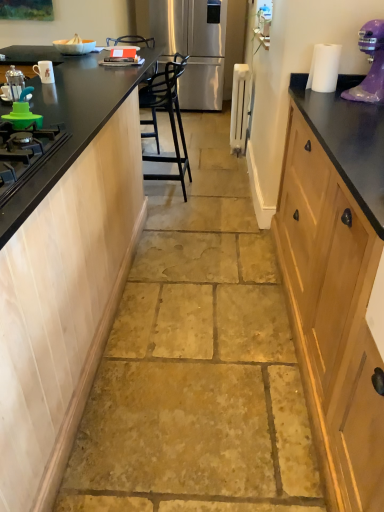
Question: Is black plastic chair at center in contact with white paper at upper right?

Choices:
 (A) no
 (B) yes

Answer: (A)

Question: Is black plastic chair at center smaller than white paper at upper right?

Choices:
 (A) no
 (B) yes

Answer: (A)

Question: Is black plastic chair at center outside white paper at upper right?

Choices:
 (A) no
 (B) yes

Answer: (B)

Question: Is white paper at upper right located within black plastic chair at center?

Choices:
 (A) yes
 (B) no

Answer: (B)

Question: Is black plastic chair at center behind white paper at upper right?

Choices:
 (A) no
 (B) yes

Answer: (B)

Question: Is white paper at upper right wider or thinner than black matte countertop at left?

Choices:
 (A) thin
 (B) wide

Answer: (A)

Question: In terms of size, does white paper at upper right appear bigger or smaller than black matte countertop at left?

Choices:
 (A) big
 (B) small

Answer: (B)

Question: From the image's perspective, relative to black matte countertop at left, is white paper at upper right above or below?

Choices:
 (A) above
 (B) below

Answer: (B)

Question: Is point (331, 84) closer or farther from the camera than point (99, 71)?

Choices:
 (A) farther
 (B) closer

Answer: (B)

Question: In terms of height, does white glossy mug at upper left, the second appliance viewed from the back, look taller or shorter compared to white paper at upper right?

Choices:
 (A) short
 (B) tall

Answer: (A)

Question: From a real-world perspective, is white glossy mug at upper left, positioned as the second appliance in top-to-bottom order, positioned above or below white paper at upper right?

Choices:
 (A) below
 (B) above

Answer: (A)

Question: In the image, is white glossy mug at upper left, the 1th appliance when ordered from bottom to top, on the left side or the right side of white paper at upper right?

Choices:
 (A) right
 (B) left

Answer: (B)

Question: Is white glossy mug at upper left, acting as the 2th appliance starting from the right, situated inside white paper at upper right or outside?

Choices:
 (A) outside
 (B) inside

Answer: (A)

Question: From a real-world perspective, relative to white paper at upper right, is black matte countertop at left vertically above or below?

Choices:
 (A) below
 (B) above

Answer: (A)

Question: Visually, is black matte countertop at left positioned to the left or to the right of white paper at upper right?

Choices:
 (A) left
 (B) right

Answer: (A)